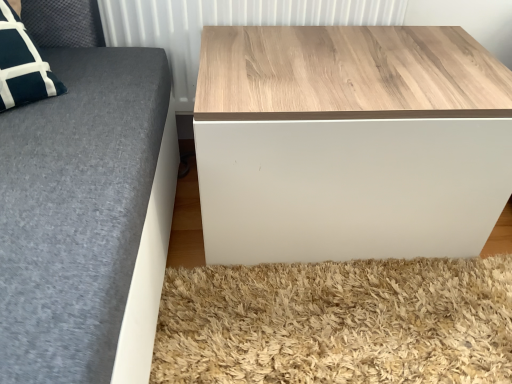
Question: Is wooden panel at upper center positioned with its back to wooden table at lower right?

Choices:
 (A) no
 (B) yes

Answer: (A)

Question: Is wooden panel at upper center surrounding wooden table at lower right?

Choices:
 (A) yes
 (B) no

Answer: (B)

Question: Is wooden panel at upper center placed right next to wooden table at lower right?

Choices:
 (A) no
 (B) yes

Answer: (A)

Question: Is wooden panel at upper center wider than wooden table at lower right?

Choices:
 (A) yes
 (B) no

Answer: (B)

Question: From the image's perspective, is wooden panel at upper center below wooden table at lower right?

Choices:
 (A) no
 (B) yes

Answer: (A)

Question: Does wooden panel at upper center have a larger size compared to wooden table at lower right?

Choices:
 (A) yes
 (B) no

Answer: (B)

Question: From a real-world perspective, is wooden table at lower right positioned under wooden panel at upper center based on gravity?

Choices:
 (A) no
 (B) yes

Answer: (B)

Question: Could wooden panel at upper center be considered to be inside wooden table at lower right?

Choices:
 (A) yes
 (B) no

Answer: (B)

Question: From a real-world perspective, is wooden table at lower right over wooden panel at upper center?

Choices:
 (A) yes
 (B) no

Answer: (B)

Question: Considering the relative sizes of wooden table at lower right and wooden panel at upper center in the image provided, is wooden table at lower right taller than wooden panel at upper center?

Choices:
 (A) yes
 (B) no

Answer: (A)

Question: Is wooden table at lower right further to camera compared to wooden panel at upper center?

Choices:
 (A) no
 (B) yes

Answer: (A)

Question: From the image's perspective, is wooden table at lower right located above wooden panel at upper center?

Choices:
 (A) no
 (B) yes

Answer: (A)

Question: From a real-world perspective, is wooden table at lower right above or below wooden panel at upper center?

Choices:
 (A) below
 (B) above

Answer: (A)